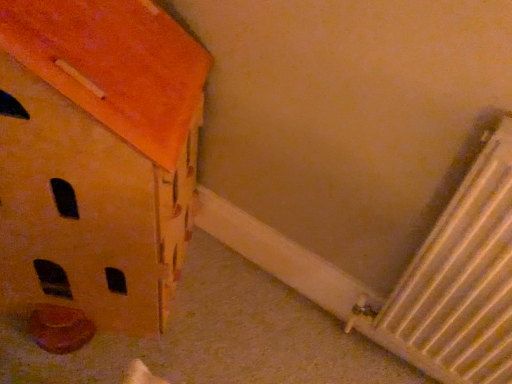
Question: Is white metallic radiator at lower right a part of matte orange cardboard box at lower left?

Choices:
 (A) no
 (B) yes

Answer: (A)

Question: From a real-world perspective, is matte orange cardboard box at lower left beneath white metallic radiator at lower right?

Choices:
 (A) no
 (B) yes

Answer: (B)

Question: Could you tell me if matte orange cardboard box at lower left is turned towards white metallic radiator at lower right?

Choices:
 (A) yes
 (B) no

Answer: (B)

Question: Is matte orange cardboard box at lower left further to camera compared to white metallic radiator at lower right?

Choices:
 (A) no
 (B) yes

Answer: (A)

Question: Is matte orange cardboard box at lower left at the right side of white metallic radiator at lower right?

Choices:
 (A) yes
 (B) no

Answer: (B)

Question: From the image's perspective, is matte orange cardboard box at lower left below white metallic radiator at lower right?

Choices:
 (A) yes
 (B) no

Answer: (B)

Question: Can you confirm if white metallic radiator at lower right is shorter than matte orange cardboard box at lower left?

Choices:
 (A) no
 (B) yes

Answer: (B)

Question: Is white metallic radiator at lower right at the right side of matte orange cardboard box at lower left?

Choices:
 (A) yes
 (B) no

Answer: (A)

Question: Are white metallic radiator at lower right and matte orange cardboard box at lower left making contact?

Choices:
 (A) no
 (B) yes

Answer: (A)

Question: Considering the relative sizes of white metallic radiator at lower right and matte orange cardboard box at lower left in the image provided, is white metallic radiator at lower right bigger than matte orange cardboard box at lower left?

Choices:
 (A) yes
 (B) no

Answer: (B)

Question: From a real-world perspective, does white metallic radiator at lower right sit lower than matte orange cardboard box at lower left?

Choices:
 (A) no
 (B) yes

Answer: (A)

Question: Considering the relative positions of white metallic radiator at lower right and matte orange cardboard box at lower left in the image provided, is white metallic radiator at lower right to the left of matte orange cardboard box at lower left from the viewer's perspective?

Choices:
 (A) no
 (B) yes

Answer: (A)

Question: From a real-world perspective, is white metallic radiator at lower right physically located above or below matte orange cardboard box at lower left?

Choices:
 (A) below
 (B) above

Answer: (B)